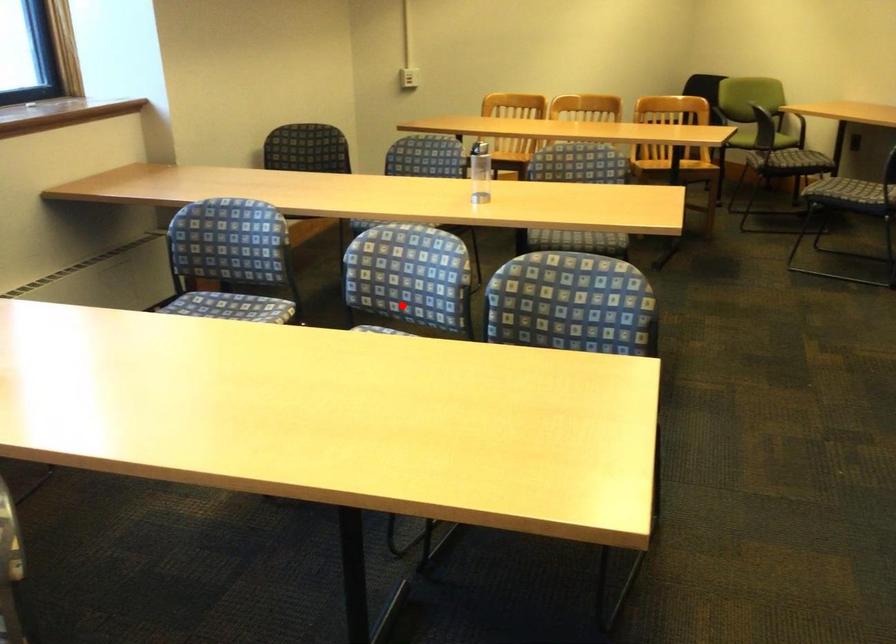
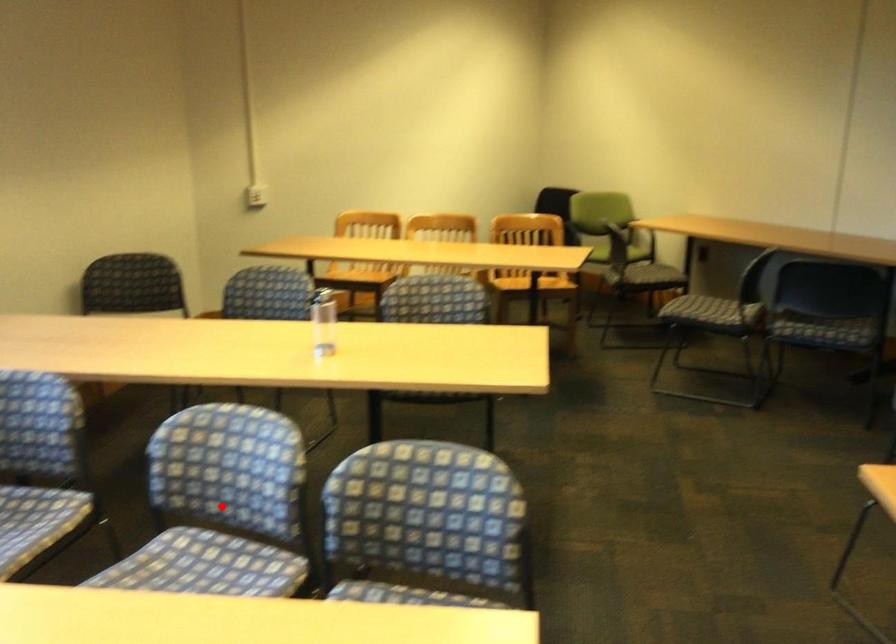
I am providing you with two images of the same scene from different viewpoints. A red point is marked on the first image and another point is marked on the second image. Is the red point in image1 aligned with the point shown in image2?

Yes